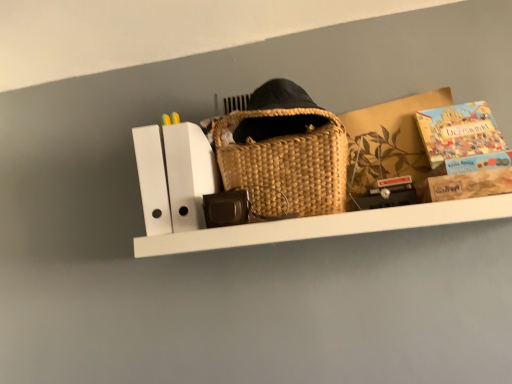
This screenshot has width=512, height=384. What do you see at coordinates (389, 140) in the screenshot? I see `brown cardboard box at upper right` at bounding box center [389, 140].

Find the location of a particular element. brown cardboard box at upper right is located at coordinates point(389,140).

Describe the element at coordinates (459, 131) in the screenshot. The image size is (512, 384). I see `matte cardboard book at upper right` at that location.

From the picture: What is the approximate height of matte cardboard book at upper right?

matte cardboard book at upper right is 11.96 inches tall.

Where is `matte cardboard book at upper right`? The image size is (512, 384). matte cardboard book at upper right is located at coordinates (459, 131).

Image resolution: width=512 pixels, height=384 pixels. What are the coordinates of `brown cardboard box at upper right` in the screenshot? It's located at (389, 140).

Which object is positioned more to the left, matte cardboard book at upper right or brown cardboard box at upper right?

brown cardboard box at upper right is more to the left.

Which object is more forward, matte cardboard book at upper right or brown cardboard box at upper right?

Positioned in front is matte cardboard book at upper right.

Considering the points (445, 147) and (358, 142), which point is behind, point (445, 147) or point (358, 142)?

The point (358, 142) is behind.

From the image's perspective, which one is positioned lower, matte cardboard book at upper right or brown cardboard box at upper right?

brown cardboard box at upper right appears lower in the image.

From a real-world perspective, between matte cardboard book at upper right and brown cardboard box at upper right, who is vertically higher?

In real-world perspective, matte cardboard book at upper right is above.

Looking at this image, which object is thinner, matte cardboard book at upper right or brown cardboard box at upper right?

matte cardboard book at upper right is thinner.

Is matte cardboard book at upper right taller than brown cardboard box at upper right?

No.

Can you confirm if matte cardboard book at upper right is smaller than brown cardboard box at upper right?

Yes.

Choose the correct answer: Is matte cardboard book at upper right inside brown cardboard box at upper right or outside it?

matte cardboard book at upper right can be found inside brown cardboard box at upper right.

Does matte cardboard book at upper right touch brown cardboard box at upper right?

No, matte cardboard book at upper right is not in contact with brown cardboard box at upper right.

In the scene shown: Is brown cardboard box at upper right at the back of matte cardboard book at upper right?

Yes.

Can you tell me how much matte cardboard book at upper right and brown cardboard box at upper right differ in facing direction?

The angular difference between matte cardboard book at upper right and brown cardboard box at upper right is 2.23 degrees.

The image size is (512, 384). In order to click on paperback book that appears on the right of brown cardboard box at upper right in this screenshot , I will do click(x=459, y=131).

Is brown cardboard box at upper right to the right of matte cardboard book at upper right from the viewer's perspective?

No.

Which object is further away from the camera taking this photo, brown cardboard box at upper right or matte cardboard book at upper right?

brown cardboard box at upper right is further away from the camera.

Which is behind, point (404, 148) or point (429, 137)?

The point (404, 148) is behind.

Based on the photo, from the image's perspective, relative to matte cardboard book at upper right, is brown cardboard box at upper right above or below?

brown cardboard box at upper right is situated lower than matte cardboard book at upper right in the image.

From a real-world perspective, is brown cardboard box at upper right positioned above or below matte cardboard book at upper right?

brown cardboard box at upper right is situated lower than matte cardboard book at upper right in the real world.

Consider the image. Looking at their sizes, would you say brown cardboard box at upper right is wider or thinner than matte cardboard book at upper right?

brown cardboard box at upper right is wider than matte cardboard book at upper right.

Between brown cardboard box at upper right and matte cardboard book at upper right, which one has more height?

brown cardboard box at upper right.

Which of these two, brown cardboard box at upper right or matte cardboard book at upper right, is bigger?

Bigger between the two is brown cardboard box at upper right.

Is brown cardboard box at upper right outside of matte cardboard book at upper right?

Yes.

Is brown cardboard box at upper right next to matte cardboard book at upper right?

No, brown cardboard box at upper right is not making contact with matte cardboard book at upper right.

Is brown cardboard box at upper right turned away from matte cardboard book at upper right?

No, matte cardboard book at upper right is not at the back of brown cardboard box at upper right.

How different are the orientations of brown cardboard box at upper right and matte cardboard book at upper right in degrees?

The facing directions of brown cardboard box at upper right and matte cardboard book at upper right are 2.23 degrees apart.

What are the coordinates of `paperback book in front of the brown cardboard box at upper right` in the screenshot? It's located at (459, 131).

Identify the location of paperback book in front of the brown cardboard box at upper right. 459,131.

In the image, there is a matte cardboard book at upper right. In order to click on cardboard box below it (from a real-world perspective) in this screenshot , I will do `click(389, 140)`.